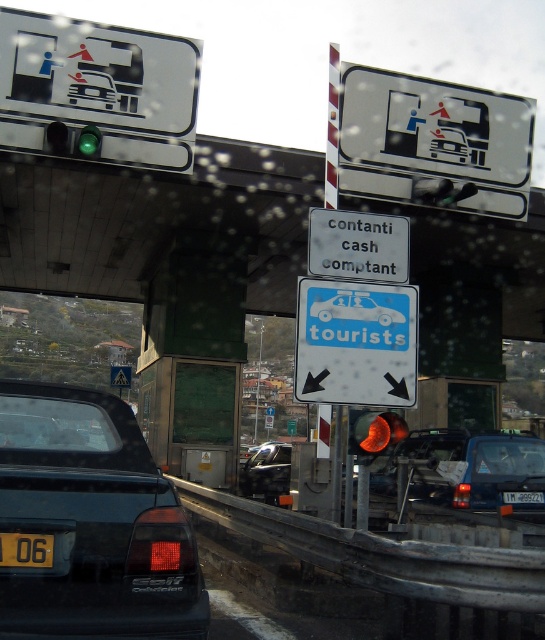
From the picture: Is brushed metal overpass at upper center to the right of yellow matte license plate at lower left from the viewer's perspective?

Yes, brushed metal overpass at upper center is to the right of yellow matte license plate at lower left.

Who is more forward, (32, 257) or (39, 557)?

Point (39, 557) is more forward.

Locate an element on the screen. The width and height of the screenshot is (545, 640). brushed metal overpass at upper center is located at coordinates (156, 220).

Is brushed metal overpass at upper center below matte black car at lower left?

Incorrect, brushed metal overpass at upper center is not positioned below matte black car at lower left.

Does point (228, 163) lie in front of point (68, 522)?

No, (228, 163) is further to viewer.

Where is `brushed metal overpass at upper center`? brushed metal overpass at upper center is located at coordinates (156, 220).

How far apart are white plastic sign at center and matte orange traffic light at center?

The distance of white plastic sign at center from matte orange traffic light at center is 3.78 feet.

Locate an element on the screen. The image size is (545, 640). white plastic sign at center is located at coordinates click(x=358, y=244).

Where is `white plastic sign at center`? white plastic sign at center is located at coordinates (358, 244).